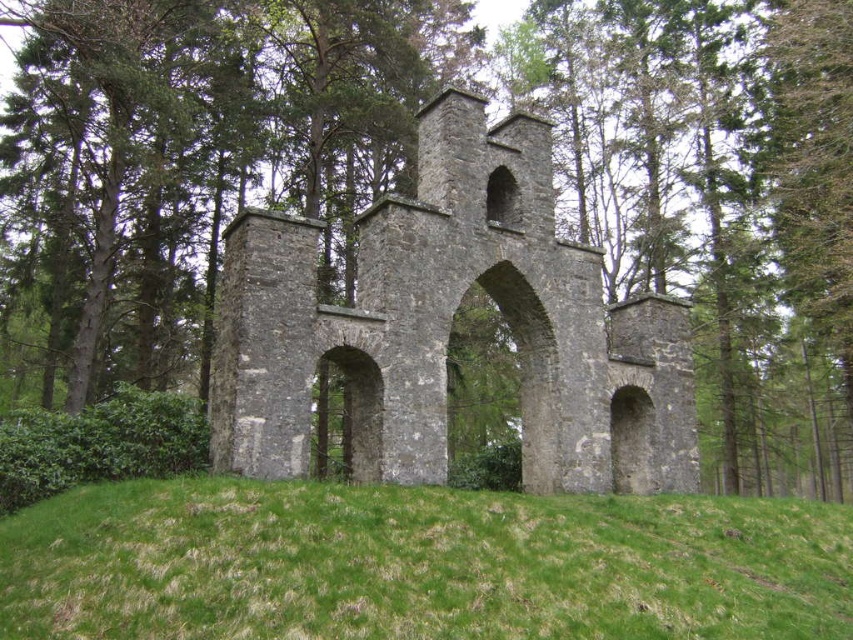
Question: Among these points, which one is nearest to the camera?

Choices:
 (A) (471, 586)
 (B) (425, 122)

Answer: (A)

Question: Can you confirm if green grassy hill at center is thinner than gray stone archway at center?

Choices:
 (A) no
 (B) yes

Answer: (A)

Question: Is green grassy hill at center wider than gray stone archway at center?

Choices:
 (A) yes
 (B) no

Answer: (A)

Question: Does green grassy hill at center appear over gray stone archway at center?

Choices:
 (A) yes
 (B) no

Answer: (B)